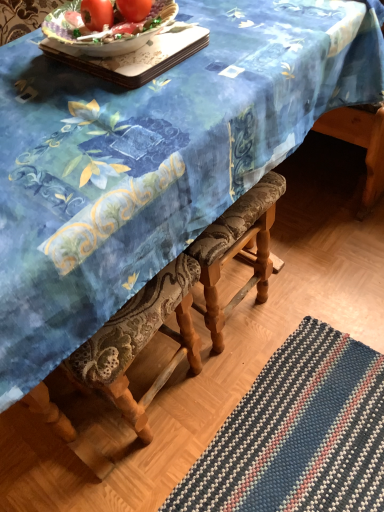
Question: Considering the positions of porcelain tray at upper center and matte red tomato at upper center, the second tomato when ordered from left to right, in the image, is porcelain tray at upper center wider or thinner than matte red tomato at upper center, the second tomato when ordered from left to right,?

Choices:
 (A) thin
 (B) wide

Answer: (B)

Question: In the image, is porcelain tray at upper center positioned in front of or behind matte red tomato at upper center, the 1th tomato in the right-to-left sequence?

Choices:
 (A) behind
 (B) front

Answer: (B)

Question: Which of these objects is positioned closest to the porcelain tray at upper center?

Choices:
 (A) matte red tomato at upper center, the second tomato when ordered from left to right
 (B) matte red tomato at upper center, which ranks as the second tomato in right-to-left order

Answer: (A)

Question: Which object is the farthest from the matte red tomato at upper center, the second tomato when ordered from left to right?

Choices:
 (A) matte red tomato at upper center, which ranks as the second tomato in right-to-left order
 (B) porcelain tray at upper center

Answer: (B)